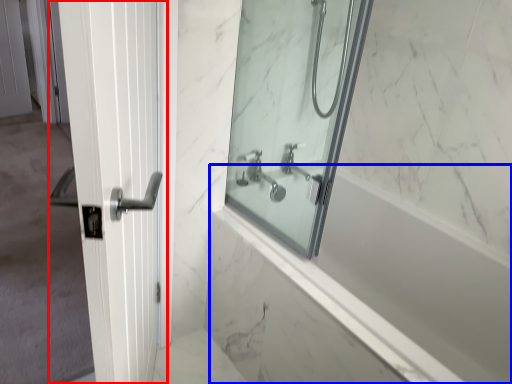
Question: Among these objects, which one is farthest to the camera, door (highlighted by a red box) or bath (highlighted by a blue box)?

Choices:
 (A) door
 (B) bath

Answer: (B)